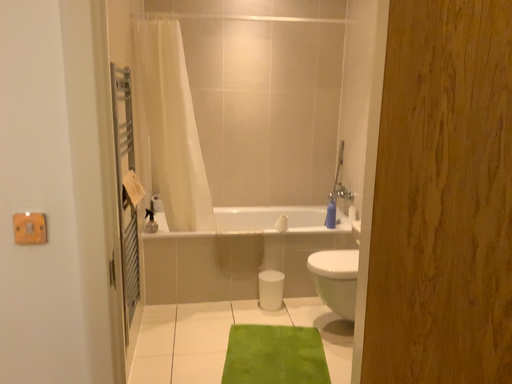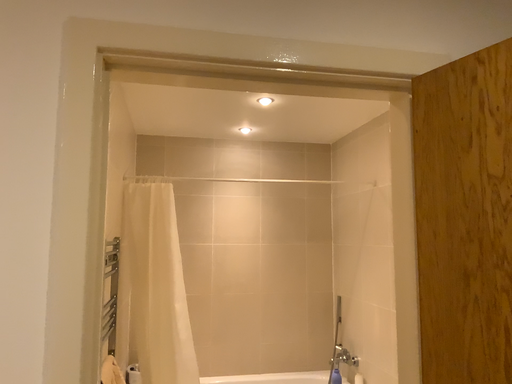
Question: How did the camera likely rotate when shooting the video?

Choices:
 (A) rotated downward
 (B) rotated upward

Answer: (B)